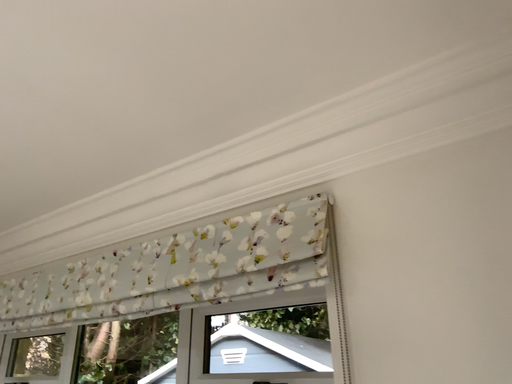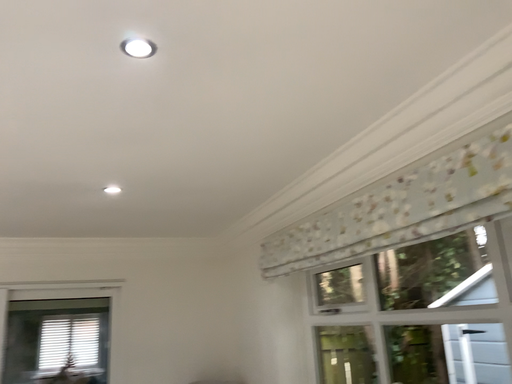
Question: How did the camera likely rotate when shooting the video?

Choices:
 (A) rotated right
 (B) rotated left

Answer: (B)